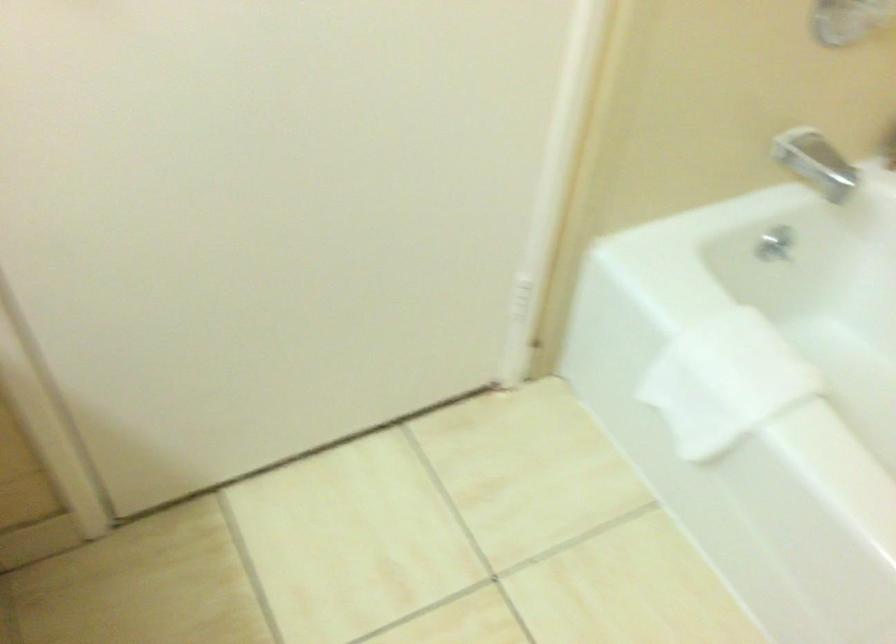
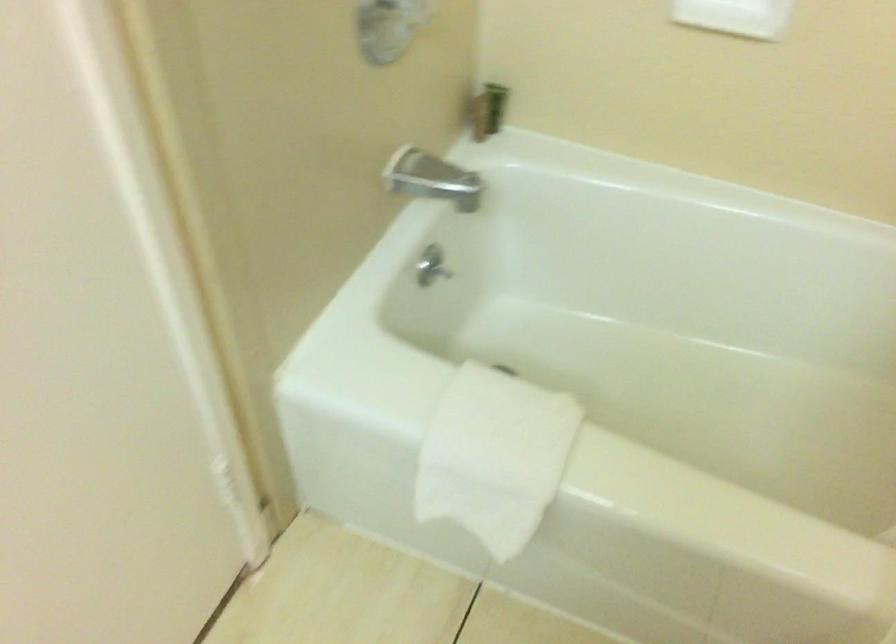
Where in the second image is the point corresponding to (810,152) from the first image?

(424, 176)